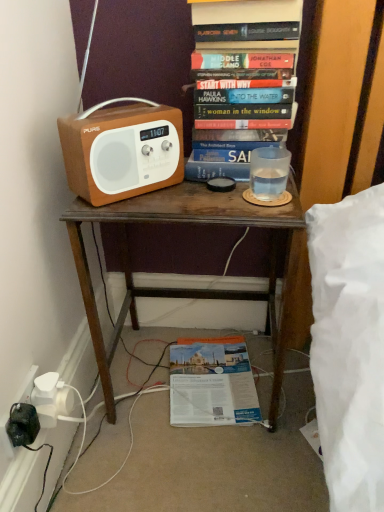
The height and width of the screenshot is (512, 384). Find the location of `vacant region in front of hardcover book at upper center, which ranks as the 1th book in top-to-bottom order`. vacant region in front of hardcover book at upper center, which ranks as the 1th book in top-to-bottom order is located at coordinates (220, 196).